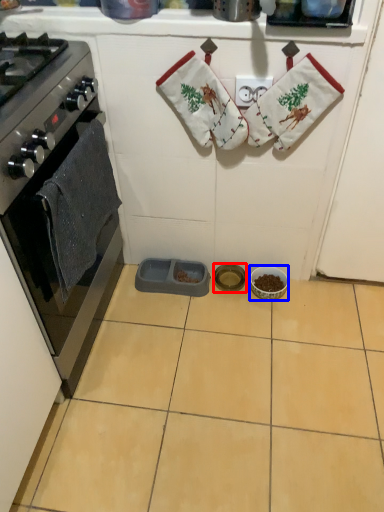
Question: Among these objects, which one is farthest to the camera, appliance (highlighted by a red box) or appliance (highlighted by a blue box)?

Choices:
 (A) appliance
 (B) appliance

Answer: (A)